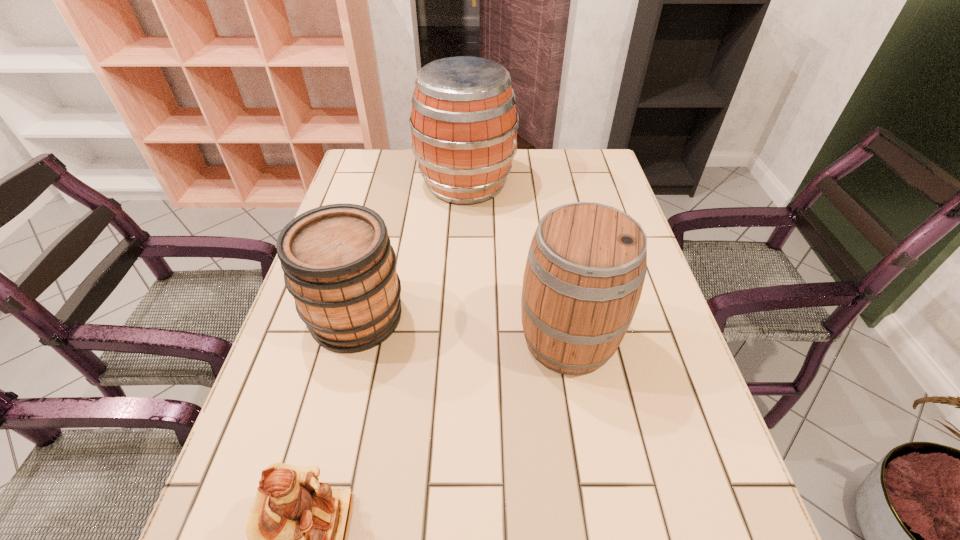
I want to click on free space that is in between the farthest cider and the second tallest cider, so click(517, 261).

Point out which object is positioned as the nearest to the shortest object. Please provide its 2D coordinates. Your answer should be formatted as a tuple, i.e. [(x, y)], where the tuple contains the x and y coordinates of a point satisfying the conditions above.

[(339, 266)]

You are a GUI agent. You are given a task and a screenshot of the screen. Output one action in this format:
    pyautogui.click(x=<x>, y=<y>)
    Task: Click on the object that ranks as the second closest to the figurine
    The image size is (960, 540).
    Given the screenshot: What is the action you would take?
    pyautogui.click(x=587, y=262)

Identify which cider is the second nearest to the third shortest object. Please provide its 2D coordinates. Your answer should be formatted as a tuple, i.e. [(x, y)], where the tuple contains the x and y coordinates of a point satisfying the conditions above.

[(464, 123)]

The width and height of the screenshot is (960, 540). Find the location of `cider that can be found as the closest to the nearest object`. cider that can be found as the closest to the nearest object is located at coordinates pyautogui.click(x=339, y=266).

The image size is (960, 540). Find the location of `vacant region that satisfies the following two spatial constraints: 1. on the front side of the second tallest object; 2. on the right side of the farthest object`. vacant region that satisfies the following two spatial constraints: 1. on the front side of the second tallest object; 2. on the right side of the farthest object is located at coordinates (460, 339).

The height and width of the screenshot is (540, 960). Identify the location of free space that satisfies the following two spatial constraints: 1. on the front side of the farthest object; 2. on the right side of the second tallest object. (460, 339).

At what (x,y) coordinates should I click in order to perform the action: click on free space that satisfies the following two spatial constraints: 1. on the front side of the shortest cider; 2. on the left side of the third shortest object. Please return your answer as a coordinate pair (x, y). This screenshot has width=960, height=540. Looking at the image, I should click on (350, 339).